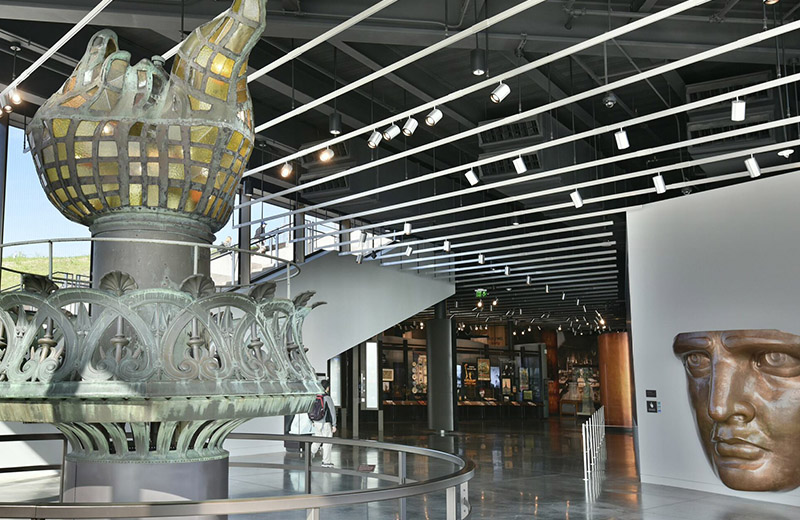
Identify the location of shiny floor. The height and width of the screenshot is (520, 800). (516, 450).